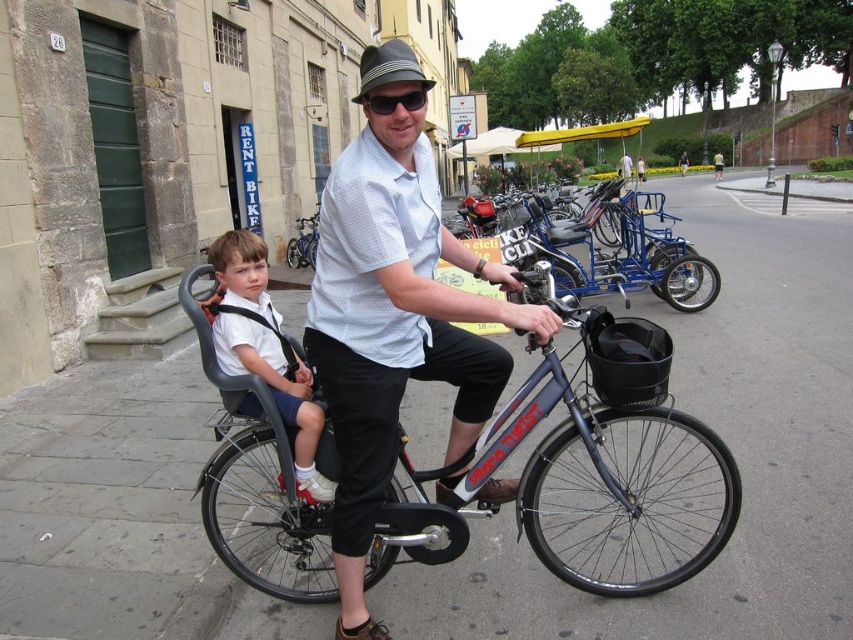
Question: Which point is closer to the camera?

Choices:
 (A) white textured shirt at center
 (B) metallic silver bicycle at center

Answer: (A)

Question: Is silver metallic bicycle at center thinner than white fabric shirt at left?

Choices:
 (A) no
 (B) yes

Answer: (A)

Question: Is white fabric shirt at left behind metallic silver bicycle at center?

Choices:
 (A) no
 (B) yes

Answer: (A)

Question: Which of the following is the closest to the observer?

Choices:
 (A) white fabric shirt at left
 (B) metallic silver bicycle at center

Answer: (A)

Question: Is white fabric shirt at left thinner than metallic silver bicycle at center?

Choices:
 (A) yes
 (B) no

Answer: (A)

Question: Which point appears farthest from the camera in this image?

Choices:
 (A) (233, 268)
 (B) (300, 250)

Answer: (B)